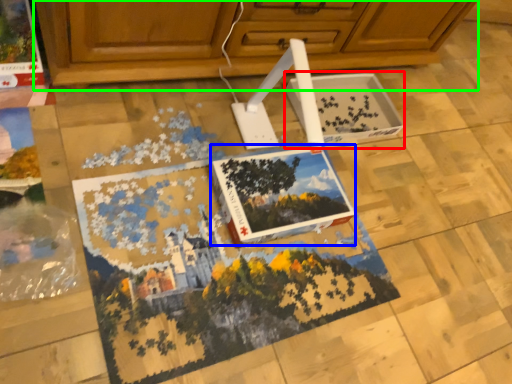
Question: Which is farther away from cardboard box (highlighted by a red box)? magazine (highlighted by a blue box) or cabinetry (highlighted by a green box)?

Choices:
 (A) magazine
 (B) cabinetry

Answer: (A)